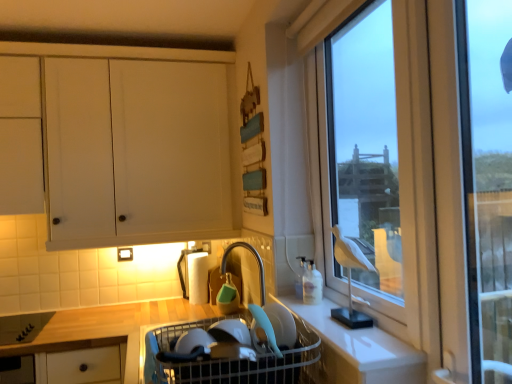
Question: From the image's perspective, is white matte counter at lower right above or below transparent glass window at right?

Choices:
 (A) below
 (B) above

Answer: (A)

Question: From a real-world perspective, relative to transparent glass window at right, is white matte counter at lower right vertically above or below?

Choices:
 (A) above
 (B) below

Answer: (B)

Question: Based on their relative distances, which object is nearer to the white matte cabinet at upper left?

Choices:
 (A) white plastic sink at center
 (B) matte plastic bowl at lower center
 (C) white matte counter at lower right
 (D) transparent glass window at right

Answer: (D)

Question: Based on their relative distances, which object is nearer to the transparent glass window at right?

Choices:
 (A) matte plastic bowl at lower center
 (B) white matte cabinet at upper left
 (C) white matte counter at lower right
 (D) white plastic sink at center

Answer: (C)